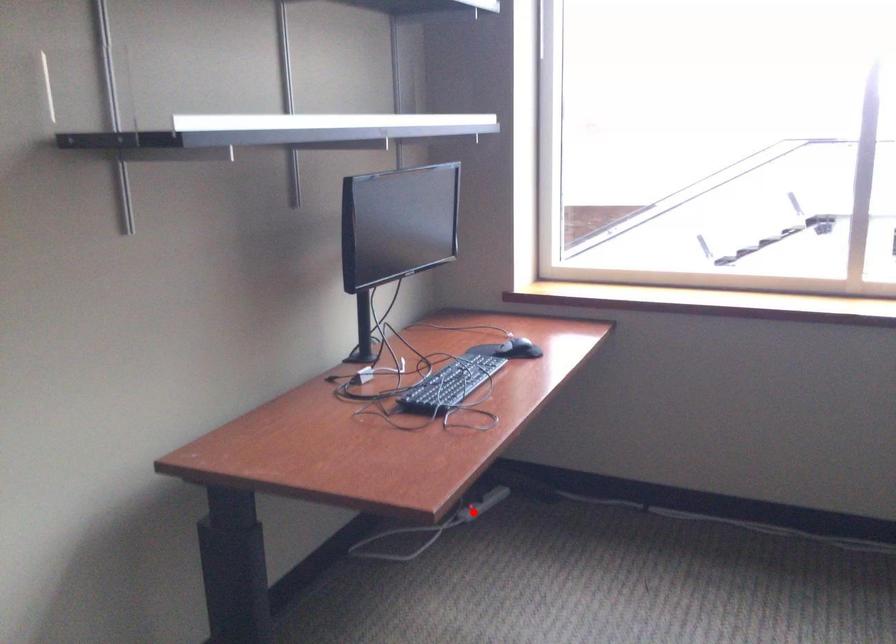
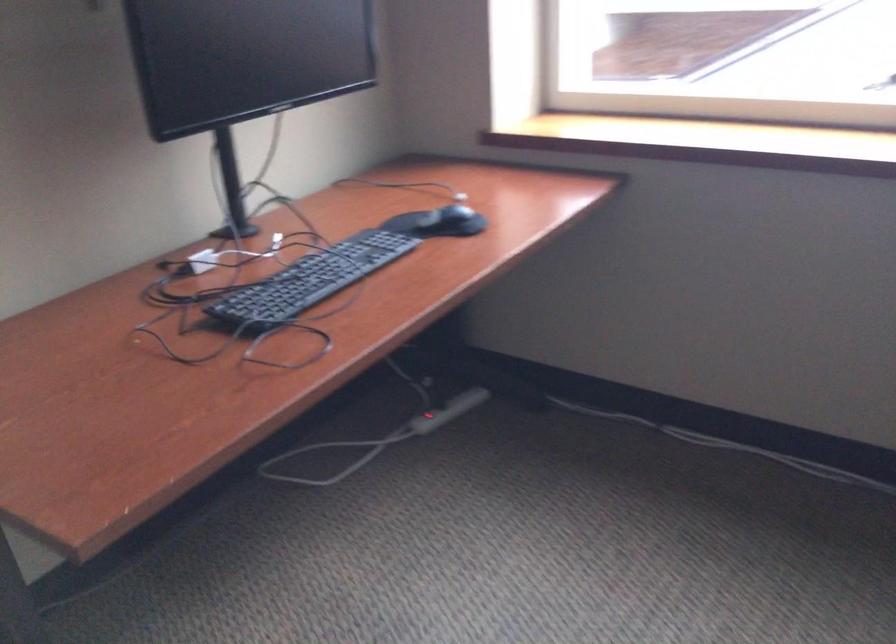
Question: I am providing you with two images of the same scene from different viewpoints. A red point is shown in image1. For the corresponding object point in image2, is it positioned nearer or farther from the camera?

Choices:
 (A) Nearer
 (B) Farther

Answer: (A)